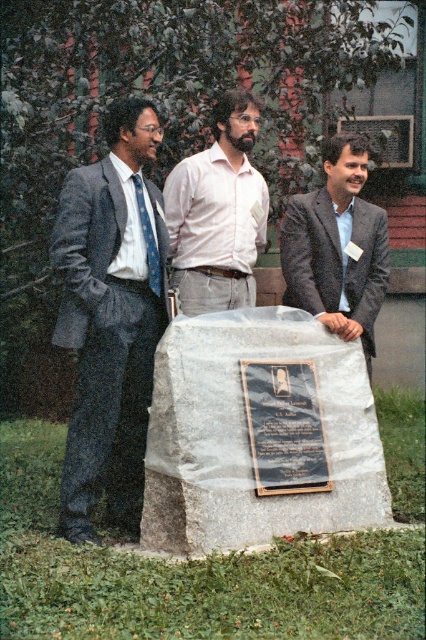
Question: Which point is closer to the camera?

Choices:
 (A) (172, 211)
 (B) (299, 387)
 (C) (126, 154)

Answer: (B)

Question: Which of the following is the closest to the observer?

Choices:
 (A) matte gray suit at center
 (B) black polished stone plaque at center
 (C) matte gray suit at left

Answer: (C)

Question: Can you confirm if gray polished stone at center is positioned below blue silk tie at left?

Choices:
 (A) no
 (B) yes

Answer: (B)

Question: Which point appears closest to the camera in this image?

Choices:
 (A) pos(154,275)
 (B) pos(317,483)
 (C) pos(365,513)

Answer: (B)

Question: Is matte gray suit at center smaller than blue silk tie at left?

Choices:
 (A) yes
 (B) no

Answer: (B)

Question: Is gray polished stone at center further to the viewer compared to matte gray suit at center?

Choices:
 (A) yes
 (B) no

Answer: (B)